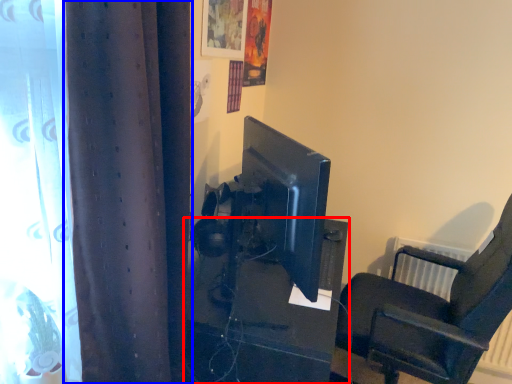
Question: Which of the following is the farthest to the observer, furniture (highlighted by a red box) or curtain (highlighted by a blue box)?

Choices:
 (A) furniture
 (B) curtain

Answer: (A)